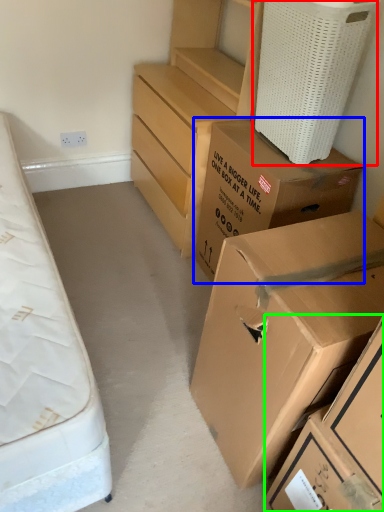
Question: Considering the real-world distances, which object is closest to laundry basket (highlighted by a red box)? box (highlighted by a blue box) or box (highlighted by a green box).

Choices:
 (A) box
 (B) box

Answer: (A)